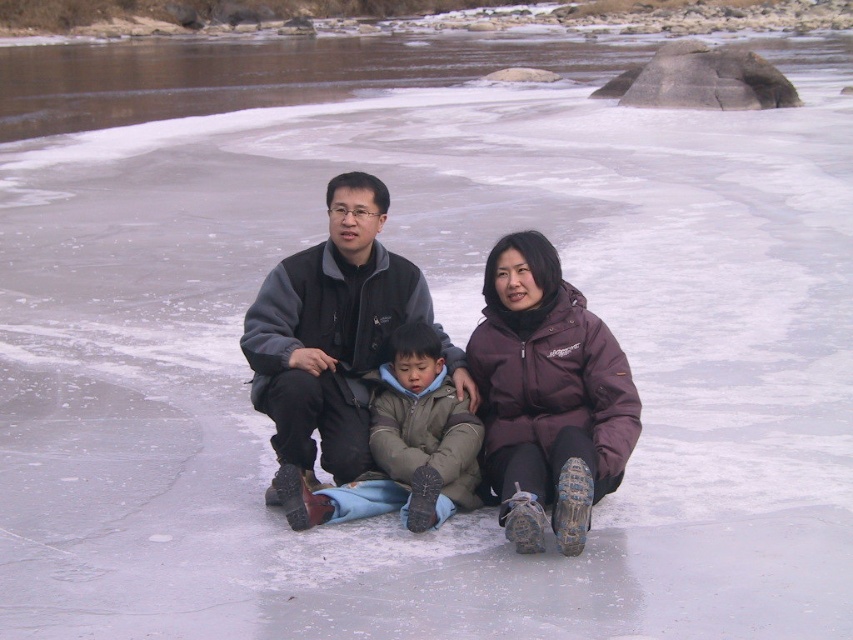
Is dark brown jacket at center below khaki fleece jacket at center?

Incorrect, dark brown jacket at center is not positioned below khaki fleece jacket at center.

From the picture: Is dark brown jacket at center smaller than khaki fleece jacket at center?

Actually, dark brown jacket at center might be larger than khaki fleece jacket at center.

This screenshot has width=853, height=640. What are the coordinates of `dark brown jacket at center` in the screenshot? It's located at (445, 364).

Locate an element on the screen. dark brown jacket at center is located at coordinates (445, 364).

The width and height of the screenshot is (853, 640). What do you see at coordinates (547, 396) in the screenshot?
I see `purple softshell jacket at center` at bounding box center [547, 396].

Is purple softshell jacket at center thinner than khaki fleece jacket at center?

Incorrect, purple softshell jacket at center's width is not less than khaki fleece jacket at center's.

I want to click on purple softshell jacket at center, so click(547, 396).

Locate an element on the screen. The height and width of the screenshot is (640, 853). purple softshell jacket at center is located at coordinates (547, 396).

Which is in front, point (288, 508) or point (486, 464)?

Point (288, 508) is more forward.

Is dark brown jacket at center below purple softshell jacket at center?

No, dark brown jacket at center is not below purple softshell jacket at center.

Between point (585, 509) and point (498, 493), which one is positioned behind?

The point (498, 493) is behind.

Locate an element on the screen. dark brown jacket at center is located at coordinates (445, 364).